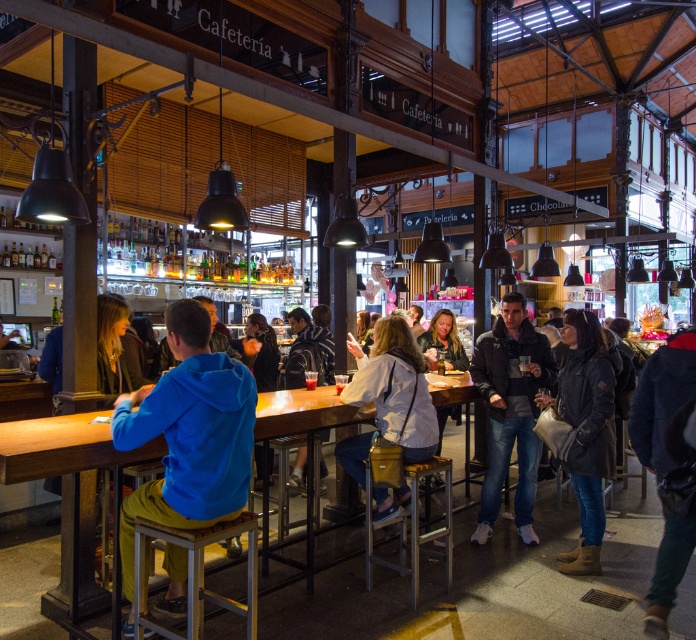
Question: Does dark blue jacket at center appear on the left side of striped sweater at center?

Choices:
 (A) no
 (B) yes

Answer: (A)

Question: Is blue fleece jacket at center wider than leather jacket at center?

Choices:
 (A) yes
 (B) no

Answer: (A)

Question: Is wooden table at center positioned in front of dark blue jacket at center?

Choices:
 (A) yes
 (B) no

Answer: (A)

Question: Which point is farther to the camera?

Choices:
 (A) (506, 333)
 (B) (560, 408)
 (C) (181, 337)

Answer: (A)

Question: Estimate the real-world distances between objects in this image. Which object is closer to the dark gray jacket at center?

Choices:
 (A) striped sweater at center
 (B) blue fleece jacket at center

Answer: (A)

Question: Among these objects, which one is farthest from the camera?

Choices:
 (A) denim jacket at lower right
 (B) dark gray jacket at center

Answer: (B)